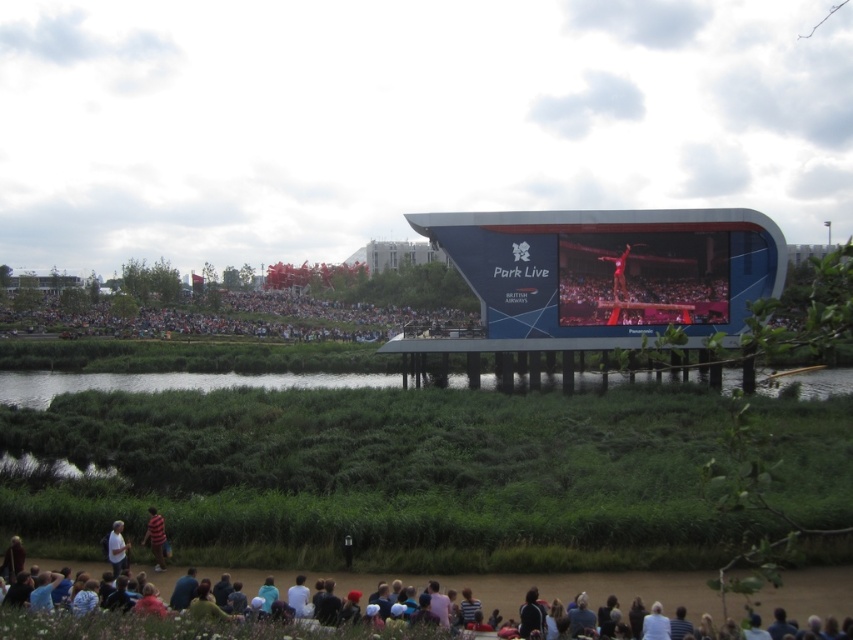
You are at an outdoor event and see a striped shirt at lower center and a red fabric person at center. Which one appears larger in size?

The striped shirt at lower center appears larger in size than the red fabric person at center.

You are a photographer positioned at the back of the crowd. You want to take a photo of the striped shirt at lower center without the blue glossy screen at center blocking the view. Is this possible?

The blue glossy screen at center is above the striped shirt at lower center, so if you position yourself lower or adjust your angle to look upward, you can capture the striped shirt at lower center without the screen blocking the view.

You are a photographer standing at the striped shirt at lower center position. You want to take a photo of the blue glossy screen at center. Considering your camera has a maximum focus range of 40 meters, will you be able to capture the screen clearly?

The blue glossy screen at center and striped shirt at lower center are 43.40 meters apart. Since the distance exceeds the camera maximum focus range of 40 meters, the photographer will not be able to capture the screen clearly.